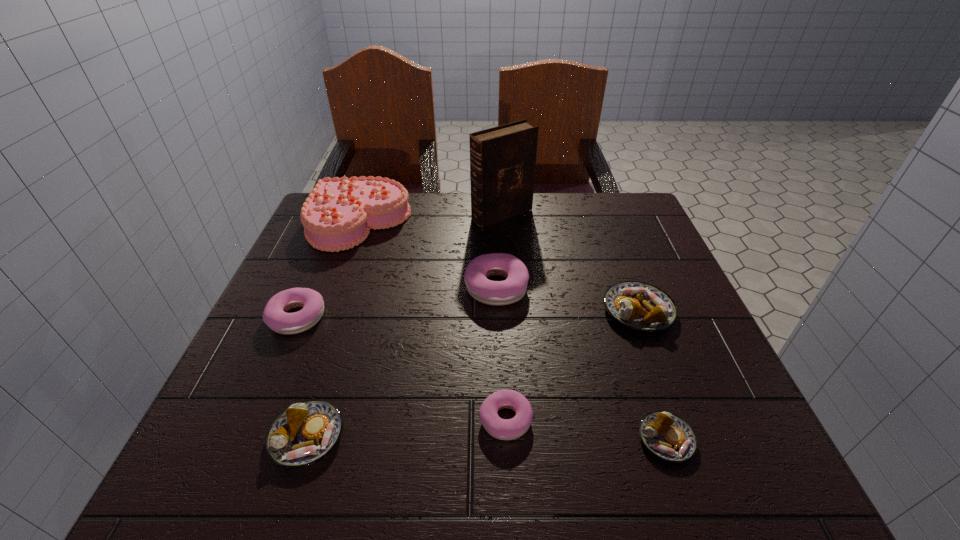
Select which object appears as the seventh closest to the biggest brown pastry. Please provide its 2D coordinates. Your answer should be formatted as a tuple, i.e. [(x, y)], where the tuple contains the x and y coordinates of a point satisfying the conditions above.

[(275, 317)]

Point out which pastry is positioned as the nearest to the second biggest pink pastry. Please provide its 2D coordinates. Your answer should be formatted as a tuple, i.e. [(x, y)], where the tuple contains the x and y coordinates of a point satisfying the conditions above.

[(306, 432)]

This screenshot has width=960, height=540. I want to click on pastry that stands as the fourth closest to the second smallest brown pastry, so [667, 436].

Image resolution: width=960 pixels, height=540 pixels. Identify the location of pink pastry identified as the closest to the biggest pink pastry. [x=504, y=429].

Locate which pink pastry ranks in proximity to the leftmost pink pastry. Please provide its 2D coordinates. Your answer should be formatted as a tuple, i.e. [(x, y)], where the tuple contains the x and y coordinates of a point satisfying the conditions above.

[(511, 290)]

Select which brown pastry appears as the second closest to the smallest pink pastry. Please provide its 2D coordinates. Your answer should be formatted as a tuple, i.e. [(x, y)], where the tuple contains the x and y coordinates of a point satisfying the conditions above.

[(306, 432)]

At what (x,y) coordinates should I click in order to perform the action: click on brown pastry that can be found as the closest to the leftmost pink pastry. Please return your answer as a coordinate pair (x, y). The height and width of the screenshot is (540, 960). Looking at the image, I should click on (306, 432).

The width and height of the screenshot is (960, 540). Identify the location of free space that satisfies the following two spatial constraints: 1. on the front side of the biggest pink pastry; 2. on the right side of the smallest pink pastry. (502, 420).

I want to click on vacant space that satisfies the following two spatial constraints: 1. on the back side of the nearest pink pastry; 2. on the right side of the Bible, so click(495, 214).

Where is `vacant space that satisfies the following two spatial constraints: 1. on the back side of the second biggest pink pastry; 2. on the right side of the tallest object`? The image size is (960, 540). vacant space that satisfies the following two spatial constraints: 1. on the back side of the second biggest pink pastry; 2. on the right side of the tallest object is located at coordinates (342, 214).